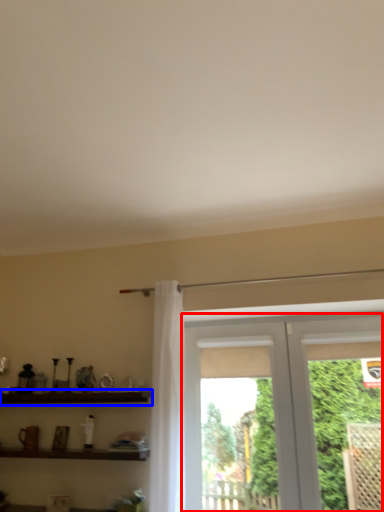
Question: Among these objects, which one is farthest to the camera, window (highlighted by a red box) or shelf (highlighted by a blue box)?

Choices:
 (A) window
 (B) shelf

Answer: (B)